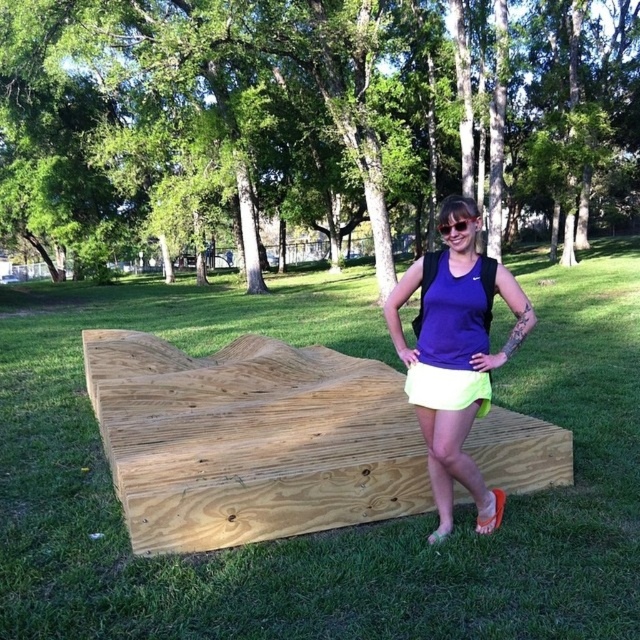
You are a fashion designer observing the woman in the park. You need to decide which item of her clothing or accessory is taller when viewed from the front. Which one is taller, the purple matte tank top at center or the clear plastic goggles at center?

The purple matte tank top at center has a greater height compared to the clear plastic goggles at center, so the purple matte tank top at center is taller.

Based on the provided scene, where is the green grass at center located in terms of coordinates?

The green grass at center is located at point (337, 529).